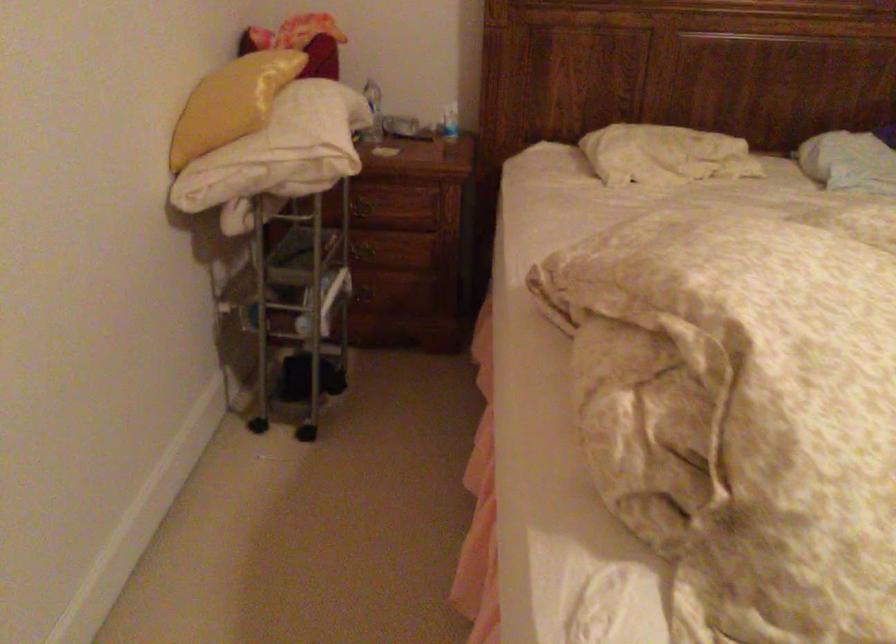
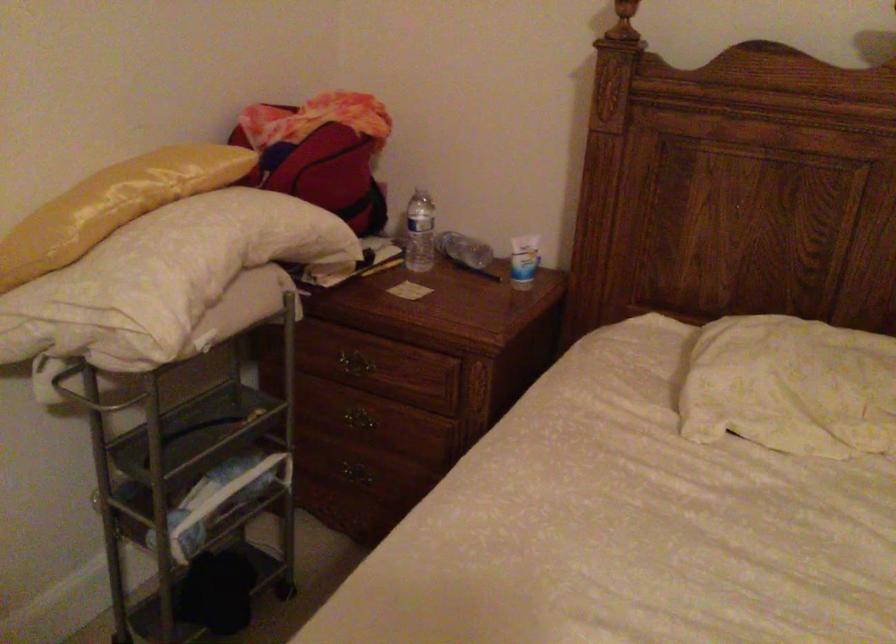
Locate, in the second image, the point that corresponds to (x=459, y=122) in the first image.

(523, 261)